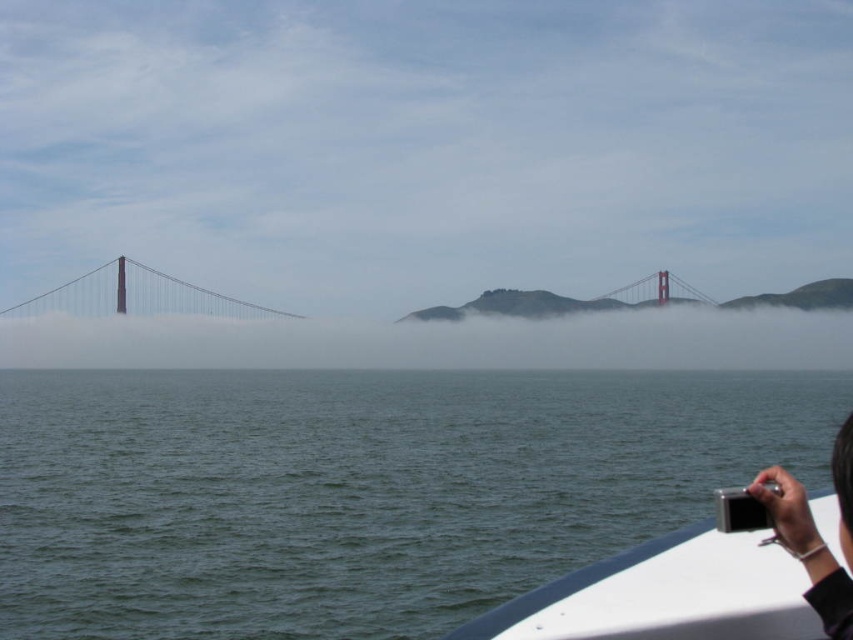
You are on a boat and want to take a photo of the metallic suspension bridge at left. However, the white plastic boat at lower right is blocking your view. Can you move the boat to get a clear shot of the bridge?

The white plastic boat at lower right is in front of the metallic suspension bridge at left, so moving the boat away would allow you to get a clear view of the bridge.

You are on a boat and want to take a photo of the metallic suspension bridge at left. Since the white plastic boat at lower right is small, will you have enough space to move around comfortably?

The white plastic boat at lower right has a lesser width compared to the metallic suspension bridge at left, so there might not be enough space to move around comfortably on the boat.

You are on a boat and want to take a photo of the Golden Gate Bridge. There are two points in the scene labeled as point 1 at coordinates point (468, 612) and point 2 at coordinates point (102, 266). Which point is closer to you?

Point 1 at coordinates point (468, 612) is closer to you than point 2 at coordinates point (102, 266).